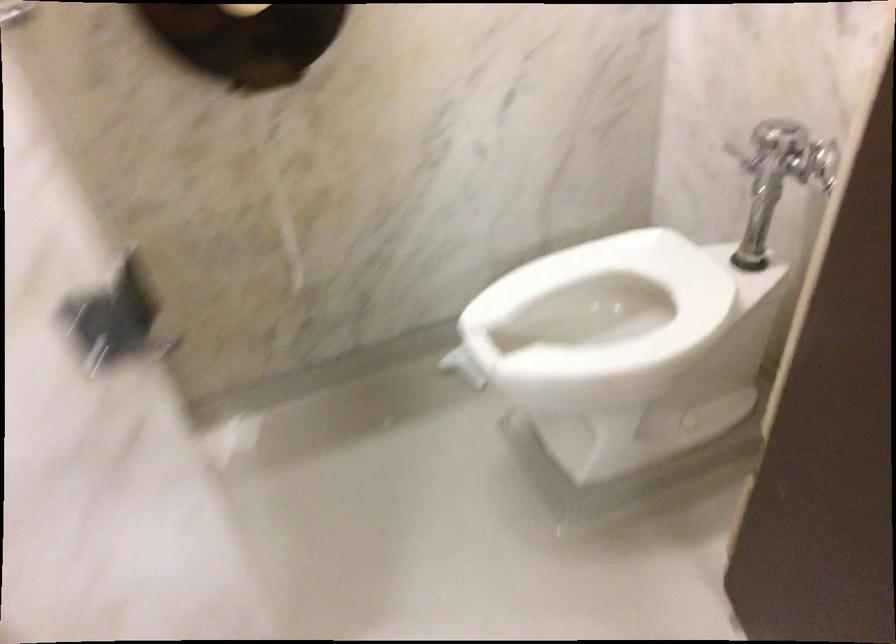
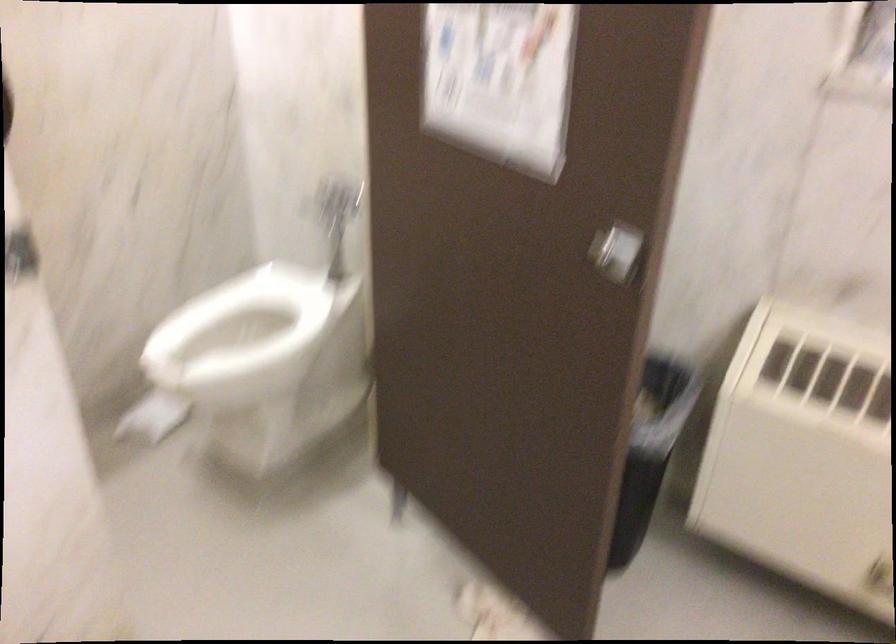
Question: The first image is from the beginning of the video and the second image is from the end. How did the camera likely rotate when shooting the video?

Choices:
 (A) Left
 (B) Right
 (C) Up
 (D) Down

Answer: (B)